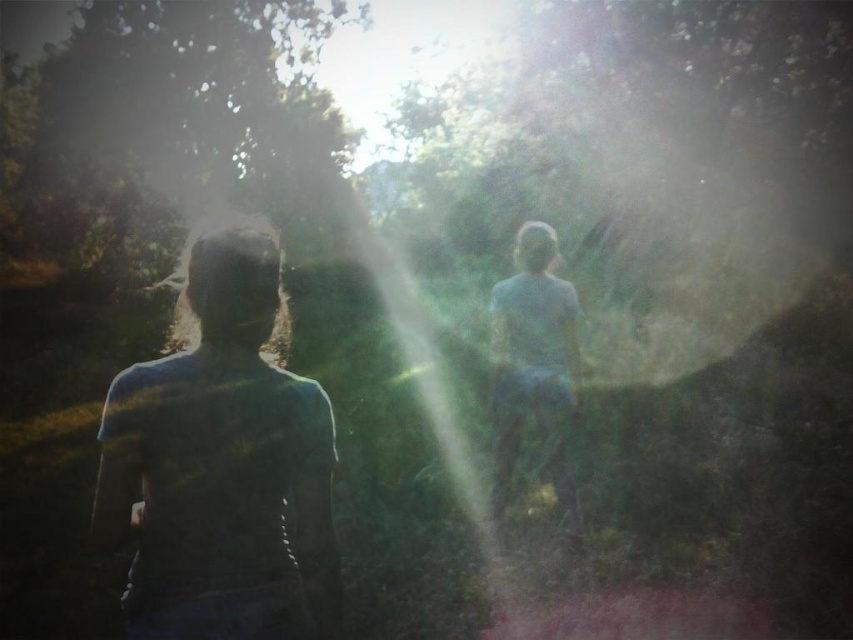
Is matte blue shirt at left smaller than light blue fabric at center?

Correct, matte blue shirt at left occupies less space than light blue fabric at center.

You are a GUI agent. You are given a task and a screenshot of the screen. Output one action in this format:
    pyautogui.click(x=<x>, y=<y>)
    Task: Click on the matte blue shirt at left
    The height and width of the screenshot is (640, 853).
    Given the screenshot: What is the action you would take?
    pyautogui.click(x=221, y=464)